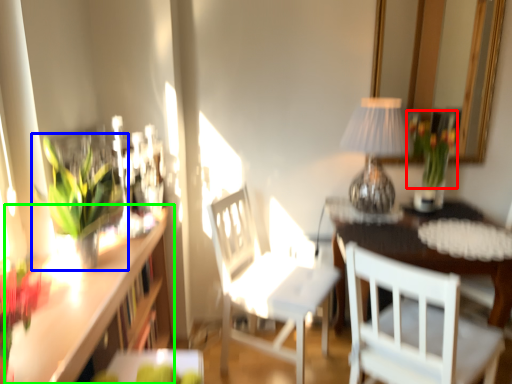
Question: Estimate the real-world distances between objects in this image. Which object is closer to floral arrangement (highlighted by a red box), houseplant (highlighted by a blue box) or counter (highlighted by a green box)?

Choices:
 (A) houseplant
 (B) counter

Answer: (B)